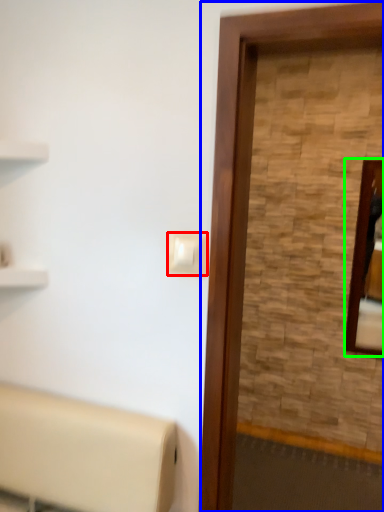
Question: Which object is positioned closest to light switch (highlighted by a red box)? Select from screen door (highlighted by a blue box) and mirror (highlighted by a green box).

Choices:
 (A) screen door
 (B) mirror

Answer: (A)